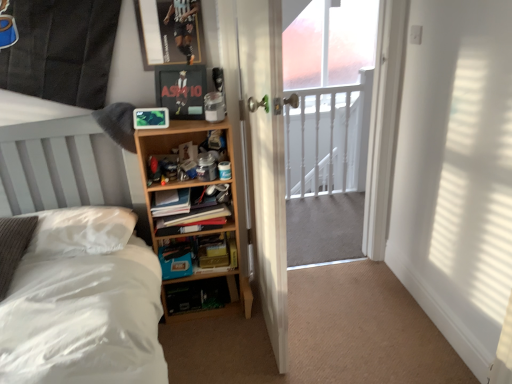
Question: Can you confirm if clear glass screen door at center is smaller than wooden bookshelf at center?

Choices:
 (A) yes
 (B) no

Answer: (B)

Question: Considering the relative sizes of clear glass screen door at center and wooden bookshelf at center in the image provided, is clear glass screen door at center bigger than wooden bookshelf at center?

Choices:
 (A) yes
 (B) no

Answer: (A)

Question: From the image's perspective, would you say clear glass screen door at center is positioned over wooden bookshelf at center?

Choices:
 (A) no
 (B) yes

Answer: (B)

Question: From a real-world perspective, is clear glass screen door at center beneath wooden bookshelf at center?

Choices:
 (A) no
 (B) yes

Answer: (A)

Question: Could you tell me if clear glass screen door at center is facing wooden bookshelf at center?

Choices:
 (A) yes
 (B) no

Answer: (B)

Question: Does clear glass screen door at center have a greater height compared to wooden bookshelf at center?

Choices:
 (A) no
 (B) yes

Answer: (B)

Question: From the image's perspective, does white soft bed at left appear lower than hardcover book at center?

Choices:
 (A) yes
 (B) no

Answer: (A)

Question: Is white soft bed at left placed right next to hardcover book at center?

Choices:
 (A) no
 (B) yes

Answer: (A)

Question: Is white soft bed at left positioned far away from hardcover book at center?

Choices:
 (A) no
 (B) yes

Answer: (A)

Question: From a real-world perspective, is white soft bed at left located higher than hardcover book at center?

Choices:
 (A) yes
 (B) no

Answer: (A)

Question: Is white soft bed at left positioned with its back to hardcover book at center?

Choices:
 (A) yes
 (B) no

Answer: (B)

Question: Considering the relative sizes of white soft bed at left and hardcover book at center in the image provided, is white soft bed at left thinner than hardcover book at center?

Choices:
 (A) yes
 (B) no

Answer: (B)

Question: Can you confirm if wooden shelf at center is taller than hardcover book at center?

Choices:
 (A) yes
 (B) no

Answer: (A)